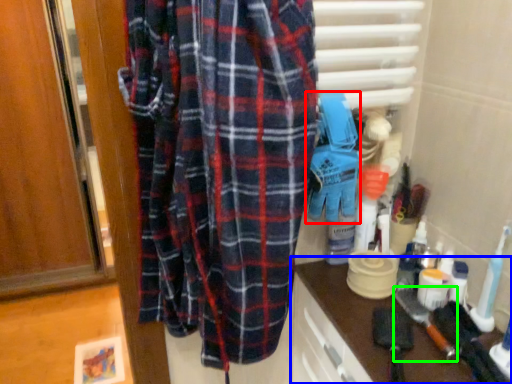
Question: Which object is the closest to the toy (highlighted by a red box)? Choose among these: counter (highlighted by a blue box) or brush (highlighted by a green box).

Choices:
 (A) counter
 (B) brush

Answer: (A)